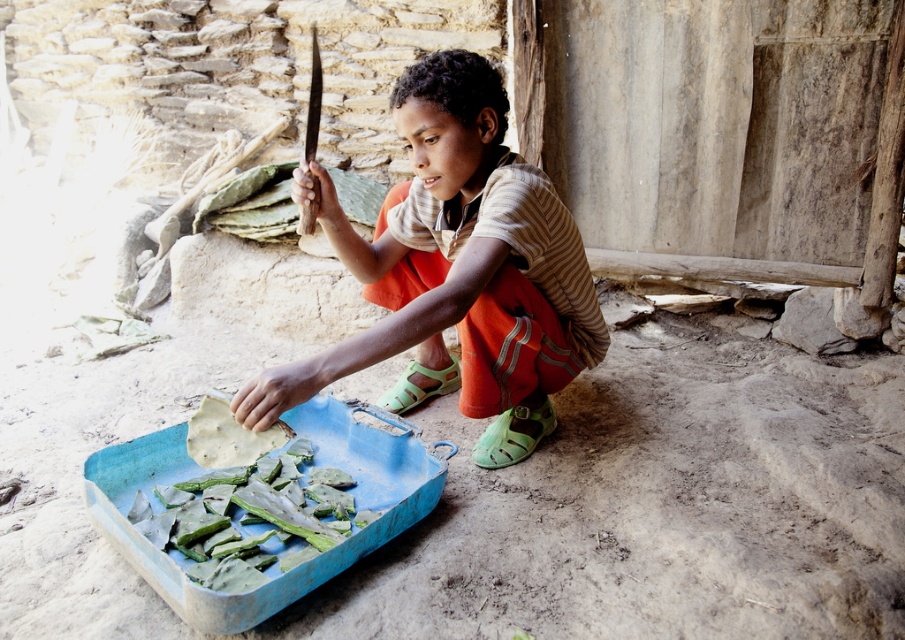
Who is shorter, matte wooden knife at center or green matte leaves at lower left?

green matte leaves at lower left

Between matte wooden knife at center and green matte leaves at lower left, which one is positioned higher?

Positioned higher is matte wooden knife at center.

Does point (546, 424) come in front of point (207, 477)?

No, (546, 424) is behind (207, 477).

Identify the location of matte wooden knife at center. (456, 269).